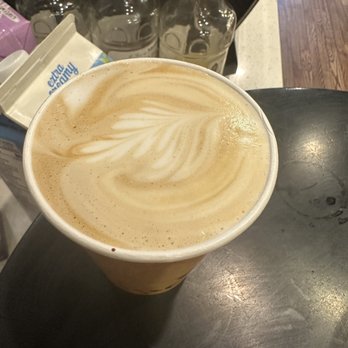
Locate an element on the screen. left end corner is located at coordinates (1, 342).